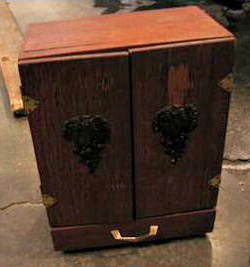
Identify the location of door. (109, 86), (165, 64).